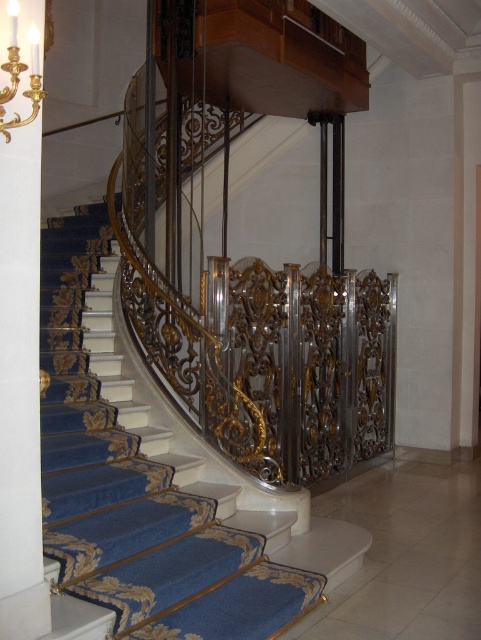
Question: Does blue carpeted stairs at center lie in front of gold metallic chandelier at upper left?

Choices:
 (A) yes
 (B) no

Answer: (B)

Question: Which point is closer to the camera?

Choices:
 (A) blue carpeted stairs at center
 (B) gold metallic chandelier at upper left

Answer: (B)

Question: Considering the relative positions of blue carpeted stairs at center and white glossy pillar at left in the image provided, where is blue carpeted stairs at center located with respect to white glossy pillar at left?

Choices:
 (A) below
 (B) above

Answer: (A)

Question: Among these points, which one is nearest to the camera?

Choices:
 (A) (115, 435)
 (B) (7, 56)

Answer: (B)

Question: Which of the following is the farthest from the observer?

Choices:
 (A) (42, 10)
 (B) (121, 620)
 (C) (37, 49)

Answer: (B)

Question: Can you confirm if white glossy pillar at left is positioned above gold metallic chandelier at upper left?

Choices:
 (A) yes
 (B) no

Answer: (B)